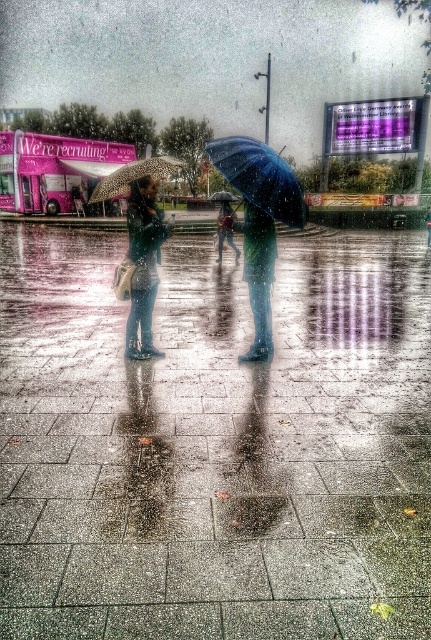
You are a delivery person who needs to deliver a package to the matte blue jacket at center. You are currently standing at point (x=143, y=264). Is the matte blue jacket at center located at your current position?

Yes, the matte blue jacket at center is located exactly at point (x=143, y=264), so you are already at the correct location.

You are a photographer trying to capture both the shiny blue umbrella at center and the leopard print fabric umbrella at center in a single frame. Given their sizes, which umbrella will appear bigger in your photo?

The shiny blue umbrella at center will appear bigger in the photo because it is larger in size than the leopard print fabric umbrella at center.